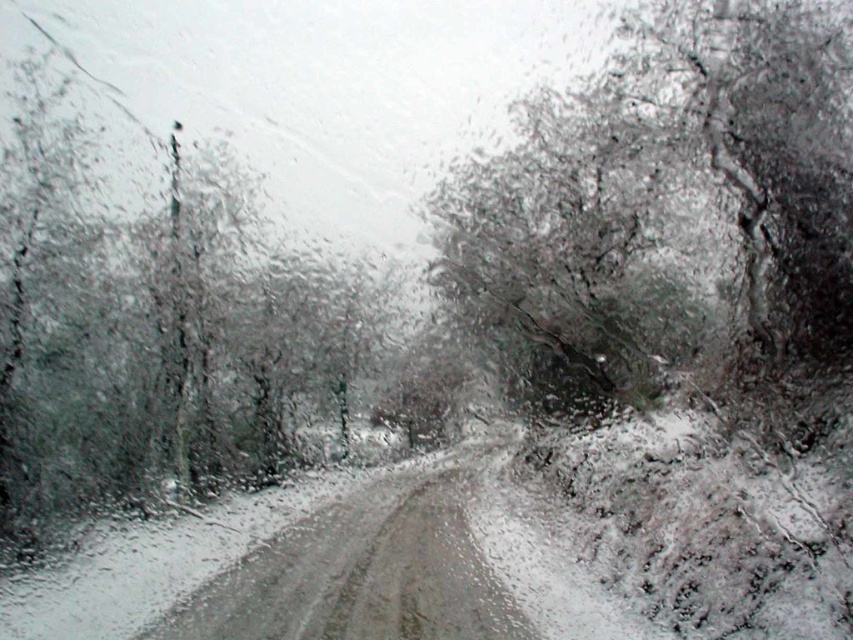
Is snowy bark tree at upper right taller than dark green textured tree at left?

No.

How far apart are snowy bark tree at upper right and dark green textured tree at left?

9.27 meters

Which is in front, point (604, 122) or point (49, 468)?

Point (49, 468) is more forward.

At what (x,y) coordinates should I click in order to perform the action: click on snowy bark tree at upper right. Please return your answer as a coordinate pair (x, y). Looking at the image, I should click on (666, 211).